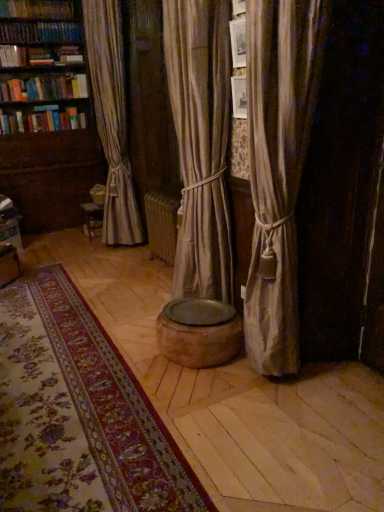
At what (x,y) coordinates should I click in order to perform the action: click on wooden bookshelf at left. Please return your answer as a coordinate pair (x, y). The image size is (384, 512). Looking at the image, I should click on (48, 119).

What is the approximate width of silky beige curtain at right?

silky beige curtain at right is 13.11 inches wide.

Find the location of a particular element. The image size is (384, 512). wooden bookshelf at left is located at coordinates (48, 119).

Which is more to the right, wooden bookshelf at left or floral carpet at center?

Positioned to the right is floral carpet at center.

Is wooden bookshelf at left beside floral carpet at center?

No, wooden bookshelf at left is not touching floral carpet at center.

Is wooden bookshelf at left outside of floral carpet at center?

That's correct, wooden bookshelf at left is outside of floral carpet at center.

Is hardcover book at upper left facing away from silky beige curtain at right?

That's not correct — hardcover book at upper left is not looking away from silky beige curtain at right.

Locate an element on the screen. curtain below the hardcover book at upper left (from a real-world perspective) is located at coordinates (278, 167).

Which point is more distant from viewer, [3,61] or [282,281]?

Point [3,61]

Which object is positioned more to the left, wooden bookshelf at left or silky beige curtain at right?

From the viewer's perspective, wooden bookshelf at left appears more on the left side.

The width and height of the screenshot is (384, 512). I want to click on curtain below the wooden bookshelf at left (from a real-world perspective), so click(x=278, y=167).

Is wooden bookshelf at left placed right next to silky beige curtain at right?

wooden bookshelf at left and silky beige curtain at right are clearly separated.

In the scene shown: Which is nearer, (48, 106) or (4, 66)?

→ Clearly, point (48, 106) is more distant from the camera than point (4, 66).

Is hardcover book at upper left at the back of wooden bookshelf at left?

Yes, hardcover book at upper left is at the back of wooden bookshelf at left.

Can you confirm if wooden bookshelf at left is wider than hardcover book at upper left?

Yes.

From the image's perspective, is wooden bookshelf at left on hardcover book at upper left?

No.

Can we say silky beige curtain at right lies outside floral carpet at center?

Indeed, silky beige curtain at right is completely outside floral carpet at center.

Is silky beige curtain at right wider or thinner than floral carpet at center?

In the image, silky beige curtain at right appears to be more narrow than floral carpet at center.

Which object is further away from the camera, silky beige curtain at right or floral carpet at center?

Positioned behind is silky beige curtain at right.

Does floral carpet at center appear on the left side of silky beige curtain at right?

Yes, floral carpet at center is to the left of silky beige curtain at right.

From the image's perspective, which is below, floral carpet at center or silky beige curtain at right?

floral carpet at center is shown below in the image.

In terms of size, does floral carpet at center appear bigger or smaller than silky beige curtain at right?

Considering their sizes, floral carpet at center takes up less space than silky beige curtain at right.

Is floral carpet at center oriented away from wooden bookshelf at left?

No, floral carpet at center is not facing the opposite direction of wooden bookshelf at left.

Which of these two, floral carpet at center or wooden bookshelf at left, is bigger?

With larger size is wooden bookshelf at left.

Between floral carpet at center and wooden bookshelf at left, which one has smaller width?

With smaller width is wooden bookshelf at left.

From the image's perspective, is floral carpet at center above or below wooden bookshelf at left?

floral carpet at center is below wooden bookshelf at left.

Where is `bookcase on the left side of floral carpet at center`? Image resolution: width=384 pixels, height=512 pixels. bookcase on the left side of floral carpet at center is located at coordinates (48, 119).

Where is `curtain on the right of the hardcover book at upper left`? The height and width of the screenshot is (512, 384). curtain on the right of the hardcover book at upper left is located at coordinates (278, 167).

From the image, which object appears to be farther from floral carpet at center, wooden bookshelf at left or hardcover book at upper left?

Based on the image, hardcover book at upper left appears to be further to floral carpet at center.

From the image, which object appears to be nearer to hardcover book at upper left, wooden bookshelf at left or floral carpet at center?

wooden bookshelf at left.

Looking at this image, from the image, which object appears to be farther from hardcover book at upper left, floral carpet at center or silky beige curtain at right?

silky beige curtain at right lies further to hardcover book at upper left than the other object.

Based on their spatial positions, is wooden bookshelf at left or silky beige curtain at right closer to floral carpet at center?

The object closer to floral carpet at center is silky beige curtain at right.

Estimate the real-world distances between objects in this image. Which object is further from silky beige curtain at right, wooden bookshelf at left or floral carpet at center?

wooden bookshelf at left is further to silky beige curtain at right.

From the image, which object appears to be farther from silky beige curtain at right, wooden bookshelf at left or hardcover book at upper left?

hardcover book at upper left is positioned further to the anchor silky beige curtain at right.

From the image, which object appears to be farther from hardcover book at upper left, silky beige curtain at right or floral carpet at center?

silky beige curtain at right.

Which object lies further to the anchor point floral carpet at center, silky beige curtain at right or wooden bookshelf at left?

wooden bookshelf at left is positioned further to the anchor floral carpet at center.

Where is `bookcase between silky beige curtain at right and hardcover book at upper left from front to back`? Image resolution: width=384 pixels, height=512 pixels. bookcase between silky beige curtain at right and hardcover book at upper left from front to back is located at coordinates (48, 119).

Identify the location of curtain between floral carpet at center and wooden bookshelf at left along the z-axis. The image size is (384, 512). [x=278, y=167].

The height and width of the screenshot is (512, 384). I want to click on bookcase located between floral carpet at center and hardcover book at upper left in the depth direction, so click(48, 119).

Where is `curtain between floral carpet at center and hardcover book at upper left from front to back`? Image resolution: width=384 pixels, height=512 pixels. curtain between floral carpet at center and hardcover book at upper left from front to back is located at coordinates (278, 167).